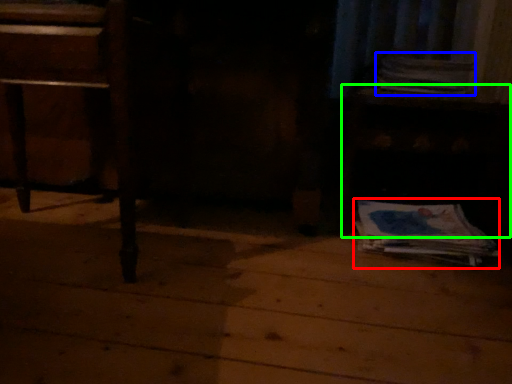
Question: Based on their relative distances, which object is nearer to paperback book (highlighted by a red box)? Choose from paperback book (highlighted by a blue box) and table (highlighted by a green box).

Choices:
 (A) paperback book
 (B) table

Answer: (B)